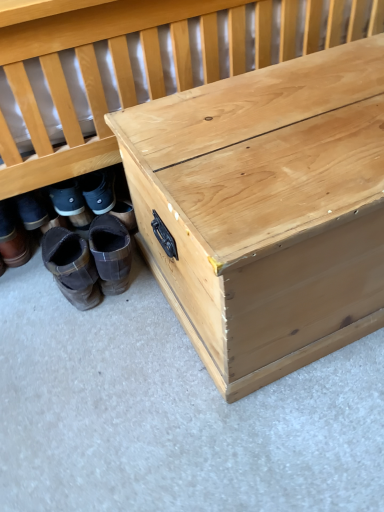
Question: From the image's perspective, does brown suede boots at lower left, the first footwear from the left, appear higher than natural wood trunk at lower right?

Choices:
 (A) no
 (B) yes

Answer: (A)

Question: Is brown suede boots at lower left, positioned as the third footwear in right-to-left order, wider than natural wood trunk at lower right?

Choices:
 (A) no
 (B) yes

Answer: (A)

Question: Is brown suede boots at lower left, positioned as the third footwear in right-to-left order, closer to camera compared to natural wood trunk at lower right?

Choices:
 (A) no
 (B) yes

Answer: (A)

Question: Is brown suede boots at lower left, the first footwear from the left, in contact with natural wood trunk at lower right?

Choices:
 (A) yes
 (B) no

Answer: (B)

Question: Can you confirm if brown suede boots at lower left, the first footwear from the left, is bigger than natural wood trunk at lower right?

Choices:
 (A) yes
 (B) no

Answer: (B)

Question: From a real-world perspective, does brown suede boots at lower left, positioned as the third footwear in right-to-left order, stand above natural wood trunk at lower right?

Choices:
 (A) yes
 (B) no

Answer: (B)

Question: Considering the relative sizes of natural wood trunk at center and brown suede boots at lower left, the 3th footwear in the left-to-right sequence, in the image provided, is natural wood trunk at center wider than brown suede boots at lower left, the 3th footwear in the left-to-right sequence,?

Choices:
 (A) no
 (B) yes

Answer: (B)

Question: From the image's perspective, is natural wood trunk at center beneath brown suede boots at lower left, which ranks as the first footwear in right-to-left order?

Choices:
 (A) no
 (B) yes

Answer: (A)

Question: Would you say natural wood trunk at center is a long distance from brown suede boots at lower left, which ranks as the first footwear in right-to-left order?

Choices:
 (A) yes
 (B) no

Answer: (B)

Question: Is natural wood trunk at center located outside brown suede boots at lower left, which ranks as the first footwear in right-to-left order?

Choices:
 (A) yes
 (B) no

Answer: (A)

Question: Can you confirm if natural wood trunk at center is thinner than brown suede boots at lower left, which ranks as the first footwear in right-to-left order?

Choices:
 (A) no
 (B) yes

Answer: (A)

Question: Could you tell me if natural wood trunk at center is facing brown suede boots at lower left, which ranks as the first footwear in right-to-left order?

Choices:
 (A) no
 (B) yes

Answer: (A)

Question: Would you say brown suede boots at lower left, positioned as the third footwear in right-to-left order, is a long distance from brown suede boots at lower left, which ranks as the first footwear in right-to-left order?

Choices:
 (A) no
 (B) yes

Answer: (A)